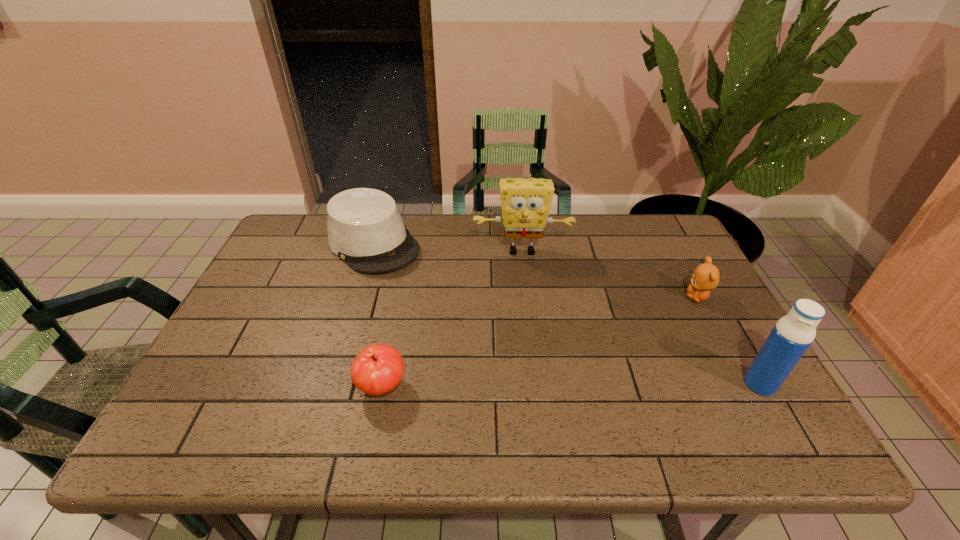
This screenshot has width=960, height=540. What are the coordinates of `object that is at the left edge` in the screenshot? It's located at (365, 229).

Locate an element on the screen. water bottle present at the right edge is located at coordinates (792, 335).

In order to click on teddy bear present at the right edge in this screenshot , I will do `click(706, 276)`.

I want to click on object at the far left corner, so click(365, 229).

This screenshot has height=540, width=960. I want to click on object that is at the near right corner, so click(x=792, y=335).

Where is `vacant space at the far edge of the desktop`? The width and height of the screenshot is (960, 540). vacant space at the far edge of the desktop is located at coordinates (545, 256).

This screenshot has width=960, height=540. Identify the location of free point at the near edge. (398, 394).

Identify the location of vacant space at the left edge. The width and height of the screenshot is (960, 540). (285, 291).

Find the location of `vacant space at the right edge of the desktop`. vacant space at the right edge of the desktop is located at coordinates (668, 274).

Locate an element on the screen. This screenshot has width=960, height=540. vacant point at the far left corner is located at coordinates (308, 216).